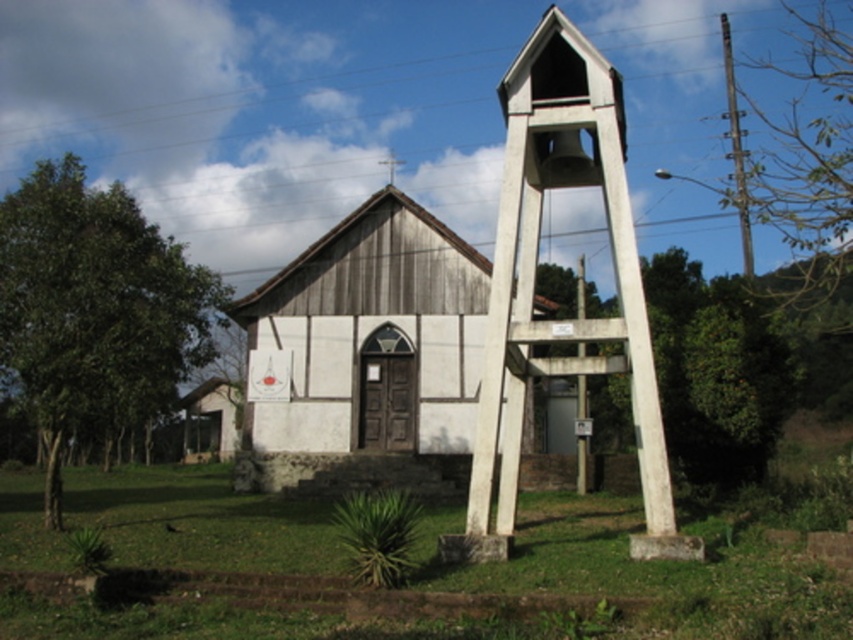
Question: Is wooden church at center smaller than white concrete bell tower at center?

Choices:
 (A) no
 (B) yes

Answer: (B)

Question: Which point is farther from the camera taking this photo?

Choices:
 (A) (519, 58)
 (B) (444, 385)

Answer: (B)

Question: Is wooden church at center above white concrete bell tower at center?

Choices:
 (A) yes
 (B) no

Answer: (B)

Question: Can you confirm if wooden church at center is bigger than white concrete bell tower at center?

Choices:
 (A) yes
 (B) no

Answer: (B)